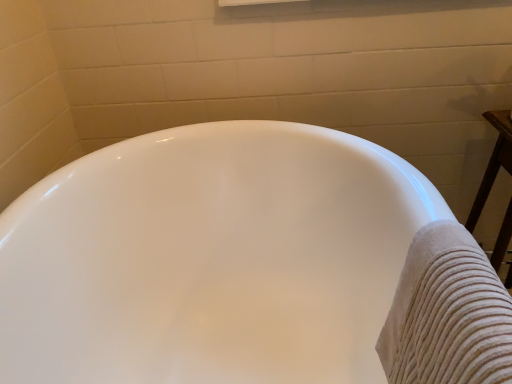
Measure the distance between point (458, 360) and camera.

The distance of point (458, 360) from camera is 18.86 inches.

What do you see at coordinates (447, 314) in the screenshot?
I see `beige textured towel at right` at bounding box center [447, 314].

At what (x,y) coordinates should I click in order to perform the action: click on beige textured towel at right. Please return your answer as a coordinate pair (x, y). This screenshot has width=512, height=384. Looking at the image, I should click on (447, 314).

The width and height of the screenshot is (512, 384). Identify the location of white glossy bathtub at center. (210, 258).

Describe the element at coordinates (210, 258) in the screenshot. I see `white glossy bathtub at center` at that location.

Where is `beige textured towel at right`? This screenshot has height=384, width=512. beige textured towel at right is located at coordinates (447, 314).

Is white glossy bathtub at center at the right side of beige textured towel at right?

Incorrect, white glossy bathtub at center is not on the right side of beige textured towel at right.

Between white glossy bathtub at center and beige textured towel at right, which one is positioned behind?

white glossy bathtub at center is further from the camera.

Which is nearer, (91, 366) or (452, 313)?

The point (452, 313) is closer.

From the image's perspective, is white glossy bathtub at center above beige textured towel at right?

No, from the image's perspective, white glossy bathtub at center is not above beige textured towel at right.

From a real-world perspective, which is physically above, white glossy bathtub at center or beige textured towel at right?

From a 3D spatial view, beige textured towel at right is above.

Can you confirm if white glossy bathtub at center is wider than beige textured towel at right?

Yes, white glossy bathtub at center is wider than beige textured towel at right.

Consider the image. Considering the relative sizes of white glossy bathtub at center and beige textured towel at right in the image provided, is white glossy bathtub at center taller than beige textured towel at right?

Indeed, white glossy bathtub at center has a greater height compared to beige textured towel at right.

Considering the relative sizes of white glossy bathtub at center and beige textured towel at right in the image provided, is white glossy bathtub at center smaller than beige textured towel at right?

No.

Could beige textured towel at right be considered to be inside white glossy bathtub at center?

Yes, beige textured towel at right is inside white glossy bathtub at center.

Is white glossy bathtub at center next to beige textured towel at right and touching it?

No, white glossy bathtub at center is not making contact with beige textured towel at right.

From the picture: Is white glossy bathtub at center oriented towards beige textured towel at right?

Yes.

What's the angular difference between white glossy bathtub at center and beige textured towel at right's facing directions?

They differ by 1.79 degrees in their facing directions.

Where is `bath towel above the white glossy bathtub at center (from the image's perspective)`? bath towel above the white glossy bathtub at center (from the image's perspective) is located at coordinates (447, 314).

Is beige textured towel at right at the right side of white glossy bathtub at center?

Correct, you'll find beige textured towel at right to the right of white glossy bathtub at center.

Considering the relative positions of beige textured towel at right and white glossy bathtub at center in the image provided, is beige textured towel at right in front of white glossy bathtub at center?

Yes, it is.

Which is in front, point (406, 267) or point (180, 175)?

The point (406, 267) is closer to the camera.

From the image's perspective, is beige textured towel at right on top of white glossy bathtub at center?

Yes.

From a real-world perspective, which object rests below the other?

From a 3D spatial view, white glossy bathtub at center is below.

Does beige textured towel at right have a greater width compared to white glossy bathtub at center?

In fact, beige textured towel at right might be narrower than white glossy bathtub at center.

Between beige textured towel at right and white glossy bathtub at center, which one has less height?

With less height is beige textured towel at right.

Considering the sizes of objects beige textured towel at right and white glossy bathtub at center in the image provided, who is smaller, beige textured towel at right or white glossy bathtub at center?

beige textured towel at right.

Is beige textured towel at right located outside white glossy bathtub at center?

No, most part of beige textured towel at right lies within white glossy bathtub at center.

Is beige textured towel at right not near white glossy bathtub at center?

beige textured towel at right is actually quite close to white glossy bathtub at center.

Is beige textured towel at right turned away from white glossy bathtub at center?

Yes, beige textured towel at right is positioned with its back facing white glossy bathtub at center.

What's the angular difference between beige textured towel at right and white glossy bathtub at center's facing directions?

1.79 degrees separate the facing orientations of beige textured towel at right and white glossy bathtub at center.

At what (x,y) coordinates should I click in order to perform the action: click on bathtub beneath the beige textured towel at right (from a real-world perspective). Please return your answer as a coordinate pair (x, y). Image resolution: width=512 pixels, height=384 pixels. Looking at the image, I should click on (210, 258).

The image size is (512, 384). Identify the location of bathtub below the beige textured towel at right (from a real-world perspective). (210, 258).

Where is `bathtub below the beige textured towel at right (from the image's perspective)`? bathtub below the beige textured towel at right (from the image's perspective) is located at coordinates (210, 258).